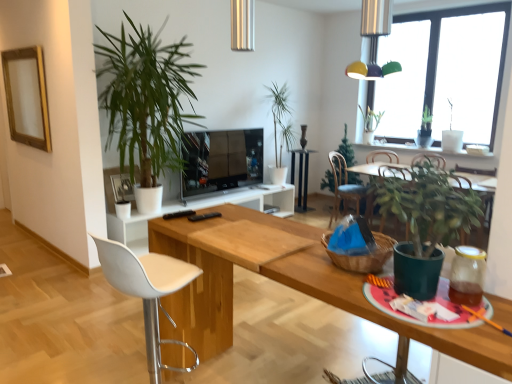
Question: Can you see black glossy side table at center touching brown woven basket at center?

Choices:
 (A) no
 (B) yes

Answer: (A)

Question: From a real-world perspective, is black glossy side table at center positioned over brown woven basket at center based on gravity?

Choices:
 (A) no
 (B) yes

Answer: (A)

Question: From the image's perspective, is black glossy side table at center above brown woven basket at center?

Choices:
 (A) no
 (B) yes

Answer: (B)

Question: Considering the relative sizes of black glossy side table at center and brown woven basket at center in the image provided, is black glossy side table at center thinner than brown woven basket at center?

Choices:
 (A) no
 (B) yes

Answer: (B)

Question: Does black glossy side table at center have a larger size compared to brown woven basket at center?

Choices:
 (A) yes
 (B) no

Answer: (A)

Question: Considering the positions of green matte plant at upper right, the first houseplant positioned from the back, and flat screen tv at center in the image, is green matte plant at upper right, the first houseplant positioned from the back, bigger or smaller than flat screen tv at center?

Choices:
 (A) small
 (B) big

Answer: (A)

Question: Looking at their shapes, would you say green matte plant at upper right, the fifth houseplant from the front, is wider or thinner than flat screen tv at center?

Choices:
 (A) thin
 (B) wide

Answer: (B)

Question: Is green matte plant at upper right, the fifth houseplant from the front, situated inside flat screen tv at center or outside?

Choices:
 (A) outside
 (B) inside

Answer: (A)

Question: Is green matte plant at upper right, the first houseplant positioned from the back, in front of or behind flat screen tv at center in the image?

Choices:
 (A) behind
 (B) front

Answer: (A)

Question: From the image's perspective, is green matte plant at right, which is the third houseplant from right to left, positioned above or below black glossy side table at center?

Choices:
 (A) below
 (B) above

Answer: (A)

Question: Is green matte plant at right, which is the 3th houseplant from left to right, wider or thinner than black glossy side table at center?

Choices:
 (A) thin
 (B) wide

Answer: (B)

Question: Considering the positions of green matte plant at right, which is the fifth houseplant in back-to-front order, and black glossy side table at center in the image, is green matte plant at right, which is the fifth houseplant in back-to-front order, taller or shorter than black glossy side table at center?

Choices:
 (A) short
 (B) tall

Answer: (A)

Question: Is green matte plant at right, which is the third houseplant from right to left, in front of or behind black glossy side table at center in the image?

Choices:
 (A) behind
 (B) front

Answer: (B)

Question: Considering the positions of point (240, 175) and point (434, 288), is point (240, 175) closer or farther from the camera than point (434, 288)?

Choices:
 (A) farther
 (B) closer

Answer: (A)

Question: From their relative heights in the image, would you say flat screen tv at center is taller or shorter than green matte plant at right, which is the third houseplant from right to left?

Choices:
 (A) short
 (B) tall

Answer: (B)